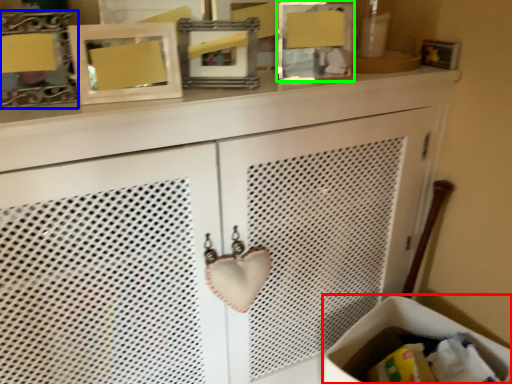
Question: Estimate the real-world distances between objects in this image. Which object is closer to laundry basket (highlighted by a red box), picture frame (highlighted by a blue box) or picture frame (highlighted by a green box)?

Choices:
 (A) picture frame
 (B) picture frame

Answer: (B)